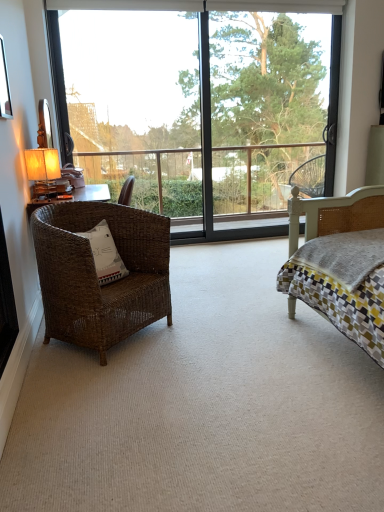
Identify the location of free space to the right of brown wicker chair at left. The image size is (384, 512). (209, 326).